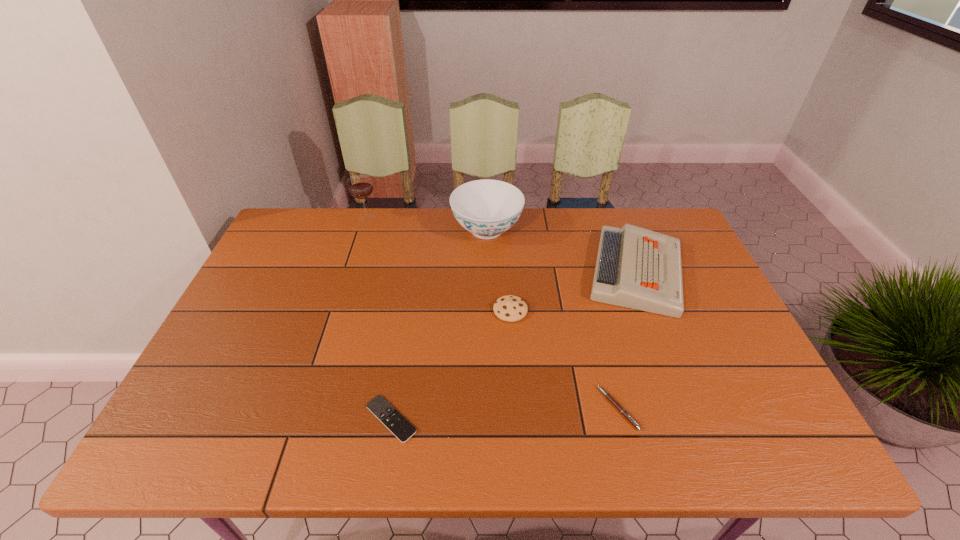
Choose which object is the third nearest neighbor to the third shortest object. Please provide its 2D coordinates. Your answer should be formatted as a tuple, i.e. [(x, y)], where the tuple contains the x and y coordinates of a point satisfying the conditions above.

[(607, 395)]

This screenshot has width=960, height=540. Identify the location of the fifth closest object relative to the tallest object. (607, 395).

Where is `free space that satisfies the following two spatial constraints: 1. at the nib of the pen; 2. on the front side of the remote control`? This screenshot has height=540, width=960. free space that satisfies the following two spatial constraints: 1. at the nib of the pen; 2. on the front side of the remote control is located at coordinates (621, 419).